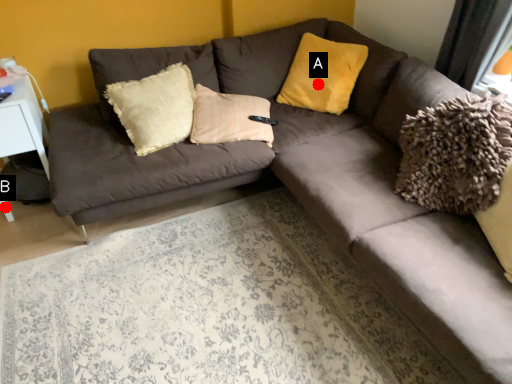
Question: Two points are circled on the image, labeled by A and B beside each circle. Among these points, which one is farthest from the camera?

Choices:
 (A) A is further
 (B) B is further

Answer: (A)